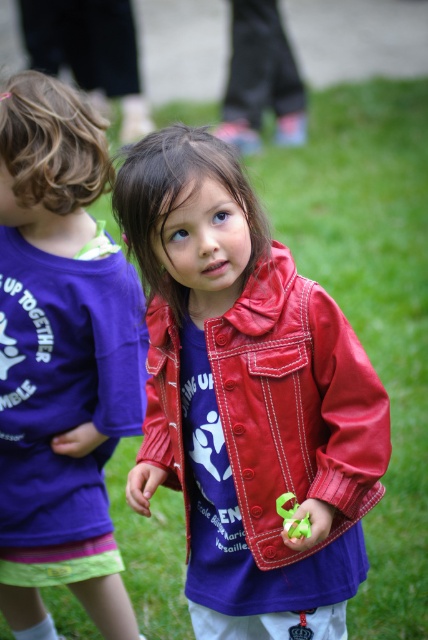
Question: Can you confirm if shiny red jacket at center is positioned above green rubber toy at center?

Choices:
 (A) yes
 (B) no

Answer: (A)

Question: Does shiny red jacket at center appear under purple cotton shirt at left?

Choices:
 (A) yes
 (B) no

Answer: (A)

Question: Does shiny red jacket at center have a larger size compared to purple cotton shirt at left?

Choices:
 (A) no
 (B) yes

Answer: (A)

Question: Which object appears closest to the camera in this image?

Choices:
 (A) green rubber toy at center
 (B) shiny red jacket at center
 (C) purple cotton shirt at left

Answer: (A)

Question: Among these points, which one is farthest from the camera?

Choices:
 (A) (160, 416)
 (B) (303, 528)

Answer: (A)

Question: Among these objects, which one is farthest from the camera?

Choices:
 (A) shiny red jacket at center
 (B) purple cotton shirt at left
 (C) green rubber toy at center

Answer: (B)